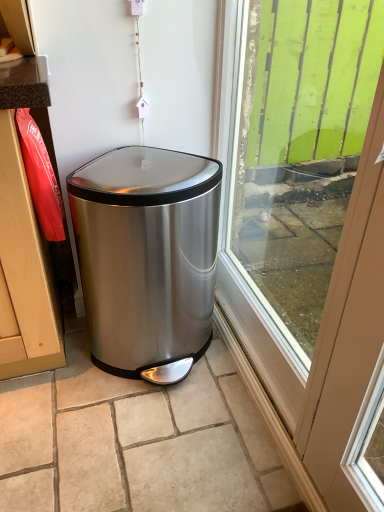
This screenshot has height=512, width=384. What do you see at coordinates (301, 149) in the screenshot?
I see `green wood at right` at bounding box center [301, 149].

The width and height of the screenshot is (384, 512). What are the coordinates of `green wood at right` in the screenshot? It's located at (301, 149).

What is the approximate width of green wood at right?

green wood at right is 4.47 inches in width.

Identify the location of polished stainless steel trash can at center. This screenshot has width=384, height=512. (146, 255).

Image resolution: width=384 pixels, height=512 pixels. What do you see at coordinates (146, 255) in the screenshot?
I see `polished stainless steel trash can at center` at bounding box center [146, 255].

At what (x,y) coordinates should I click in order to perform the action: click on green wood at right. Please return your answer as a coordinate pair (x, y). This screenshot has height=512, width=384. Looking at the image, I should click on (301, 149).

Which object is positioned more to the left, polished stainless steel trash can at center or green wood at right?

Positioned to the left is polished stainless steel trash can at center.

Is polished stainless steel trash can at center positioned in front of green wood at right?

No, polished stainless steel trash can at center is further to the viewer.

Between point (130, 163) and point (296, 127), which one is positioned in front?

The point (130, 163) is closer.

From the image's perspective, does polished stainless steel trash can at center appear lower than green wood at right?

Yes.

From a real-world perspective, is polished stainless steel trash can at center over green wood at right?

Actually, polished stainless steel trash can at center is physically below green wood at right in the real world.

Considering the sizes of objects polished stainless steel trash can at center and green wood at right in the image provided, who is wider, polished stainless steel trash can at center or green wood at right?

polished stainless steel trash can at center is wider.

Between polished stainless steel trash can at center and green wood at right, which one has less height?

polished stainless steel trash can at center.

Between polished stainless steel trash can at center and green wood at right, which one has larger size?

Bigger between the two is polished stainless steel trash can at center.

Is polished stainless steel trash can at center spatially inside green wood at right, or outside of it?

polished stainless steel trash can at center cannot be found inside green wood at right.

Are polished stainless steel trash can at center and green wood at right beside each other?

No, polished stainless steel trash can at center is not in contact with green wood at right.

Is polished stainless steel trash can at center facing away from green wood at right?

No, polished stainless steel trash can at center's orientation is not away from green wood at right.

How different are the orientations of polished stainless steel trash can at center and green wood at right in degrees?

The facing directions of polished stainless steel trash can at center and green wood at right are 88.7 degrees apart.

Where is `window screen on the right of polished stainless steel trash can at center`? window screen on the right of polished stainless steel trash can at center is located at coordinates [x=301, y=149].

Considering the positions of objects green wood at right and polished stainless steel trash can at center in the image provided, who is more to the left, green wood at right or polished stainless steel trash can at center?

polished stainless steel trash can at center.

Relative to polished stainless steel trash can at center, is green wood at right in front or behind?

Visually, green wood at right is located in front of polished stainless steel trash can at center.

Is point (313, 42) more distant than point (110, 161)?

That is True.

From the image's perspective, does green wood at right appear higher than polished stainless steel trash can at center?

Indeed, from the image's perspective, green wood at right is shown above polished stainless steel trash can at center.

From a real-world perspective, is green wood at right positioned under polished stainless steel trash can at center based on gravity?

No, from a real-world perspective, green wood at right is not beneath polished stainless steel trash can at center.

In the scene shown: In terms of width, does green wood at right look wider or thinner when compared to polished stainless steel trash can at center?

In the image, green wood at right appears to be more narrow than polished stainless steel trash can at center.

Considering the sizes of objects green wood at right and polished stainless steel trash can at center in the image provided, who is taller, green wood at right or polished stainless steel trash can at center?

green wood at right.

Considering the sizes of objects green wood at right and polished stainless steel trash can at center in the image provided, who is bigger, green wood at right or polished stainless steel trash can at center?

polished stainless steel trash can at center.

Is green wood at right not inside polished stainless steel trash can at center?

That's correct, green wood at right is outside of polished stainless steel trash can at center.

Is green wood at right far away from polished stainless steel trash can at center?

No, green wood at right is not far from polished stainless steel trash can at center.

Is green wood at right oriented towards polished stainless steel trash can at center?

Yes, green wood at right is aimed at polished stainless steel trash can at center.

I want to click on waste container that appears behind the green wood at right, so click(146, 255).

Where is `waste container lying on the left of green wood at right`? This screenshot has height=512, width=384. waste container lying on the left of green wood at right is located at coordinates (146, 255).

Image resolution: width=384 pixels, height=512 pixels. I want to click on window screen above the polished stainless steel trash can at center (from a real-world perspective), so click(x=301, y=149).